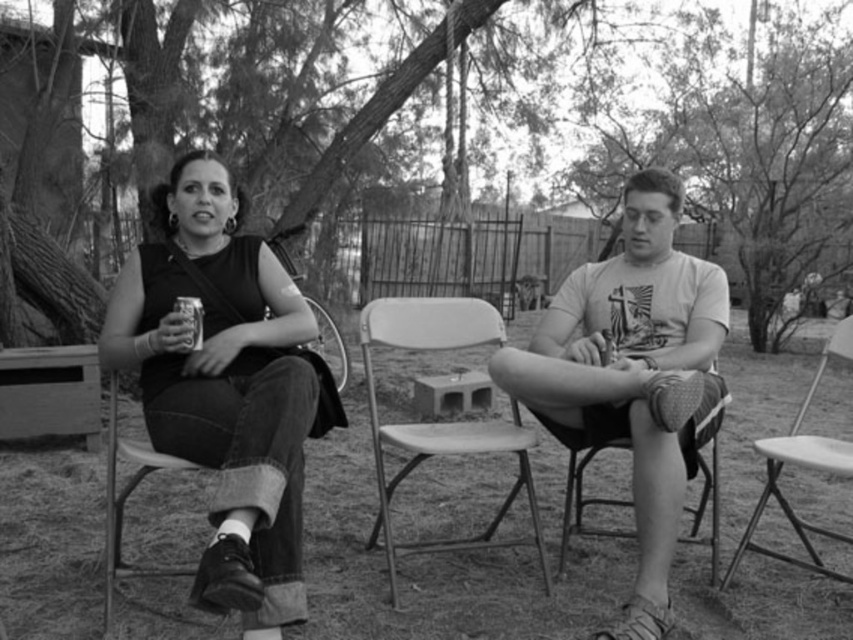
You are standing in the backyard scene and want to know which of the two points, point (741,54) or point (193,305), is closer to you. Based on the image, which one is closer?

Point (741,54) is further to the camera than point (193,305), so the point closer to you is point (193,305).

You are a photographer holding a camera. You want to take a photo of the metallic folding chair at center from a distance that allows you to capture the entire chair without moving closer. Given that the camera has a standard lens with a focal length of 50mm, what is the minimum distance you need to be from the chair to ensure it fits within the frame?

The metallic folding chair at center and camera are 2.68 meters apart from each other. Since the standard lens at 50mm typically has a field of view that can capture objects at that distance without needing to move closer, you can stay at the current distance of 2.68 meters to include the entire chair in the frame.